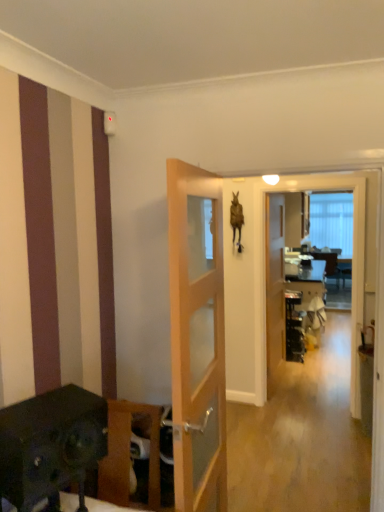
Question: Considering the relative positions of wooden door at center, the second door from the left, and light wood/glass door at center, which appears as the second door when viewed from the back, in the image provided, is wooden door at center, the second door from the left, to the right of light wood/glass door at center, which appears as the second door when viewed from the back, from the viewer's perspective?

Choices:
 (A) yes
 (B) no

Answer: (A)

Question: Does wooden door at center, placed as the first door when sorted from back to front, have a greater width compared to light wood/glass door at center, the 1th door when ordered from front to back?

Choices:
 (A) no
 (B) yes

Answer: (A)

Question: Is wooden door at center, the 1th door positioned from the right, completely or partially outside of light wood/glass door at center, which is counted as the 2th door, starting from the right?

Choices:
 (A) yes
 (B) no

Answer: (A)

Question: From a real-world perspective, is wooden door at center, placed as the first door when sorted from back to front, positioned under light wood/glass door at center, which is counted as the 2th door, starting from the right, based on gravity?

Choices:
 (A) no
 (B) yes

Answer: (B)

Question: Can you confirm if wooden door at center, the 1th door positioned from the right, is taller than light wood/glass door at center, which is counted as the 2th door, starting from the right?

Choices:
 (A) yes
 (B) no

Answer: (A)

Question: Would you say wooden cabinet at lower left is to the left or to the right of transparent glass screen door at center in the picture?

Choices:
 (A) left
 (B) right

Answer: (A)

Question: Looking at their shapes, would you say wooden cabinet at lower left is wider or thinner than transparent glass screen door at center?

Choices:
 (A) wide
 (B) thin

Answer: (A)

Question: From a real-world perspective, relative to transparent glass screen door at center, is wooden cabinet at lower left vertically above or below?

Choices:
 (A) above
 (B) below

Answer: (B)

Question: In the image, is wooden cabinet at lower left positioned in front of or behind transparent glass screen door at center?

Choices:
 (A) behind
 (B) front

Answer: (B)

Question: In terms of width, does wooden door at center, the 1th door positioned from the right, look wider or thinner when compared to transparent glass screen door at center?

Choices:
 (A) thin
 (B) wide

Answer: (A)

Question: From the image's perspective, is wooden door at center, placed as the first door when sorted from back to front, positioned above or below transparent glass screen door at center?

Choices:
 (A) above
 (B) below

Answer: (A)

Question: Looking at the image, does wooden door at center, the second door from the left, seem bigger or smaller compared to transparent glass screen door at center?

Choices:
 (A) small
 (B) big

Answer: (A)

Question: Based on their positions, is wooden door at center, placed as the first door when sorted from back to front, located to the left or right of transparent glass screen door at center?

Choices:
 (A) right
 (B) left

Answer: (B)

Question: In terms of width, does transparent glass screen door at center look wider or thinner when compared to wooden cabinet at lower left?

Choices:
 (A) wide
 (B) thin

Answer: (B)

Question: Is transparent glass screen door at center inside or outside of wooden cabinet at lower left?

Choices:
 (A) outside
 (B) inside

Answer: (A)